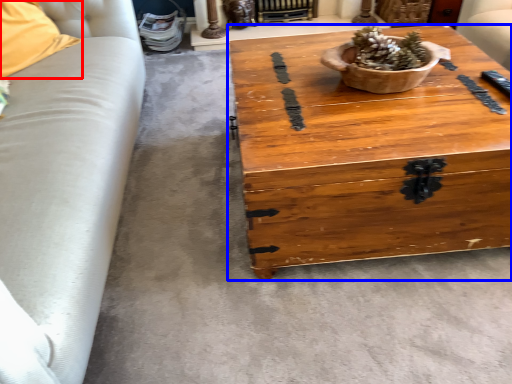
Question: Which of the following is the closest to the observer, pillow (highlighted by a red box) or coffee table (highlighted by a blue box)?

Choices:
 (A) pillow
 (B) coffee table

Answer: (B)